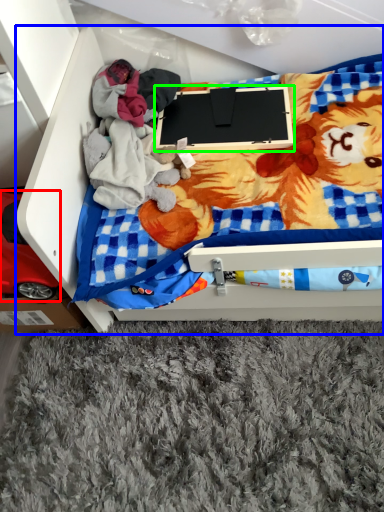
Question: Considering the real-world distances, which object is farthest from toy (highlighted by a red box)? furniture (highlighted by a blue box) or laptop (highlighted by a green box)?

Choices:
 (A) furniture
 (B) laptop

Answer: (B)